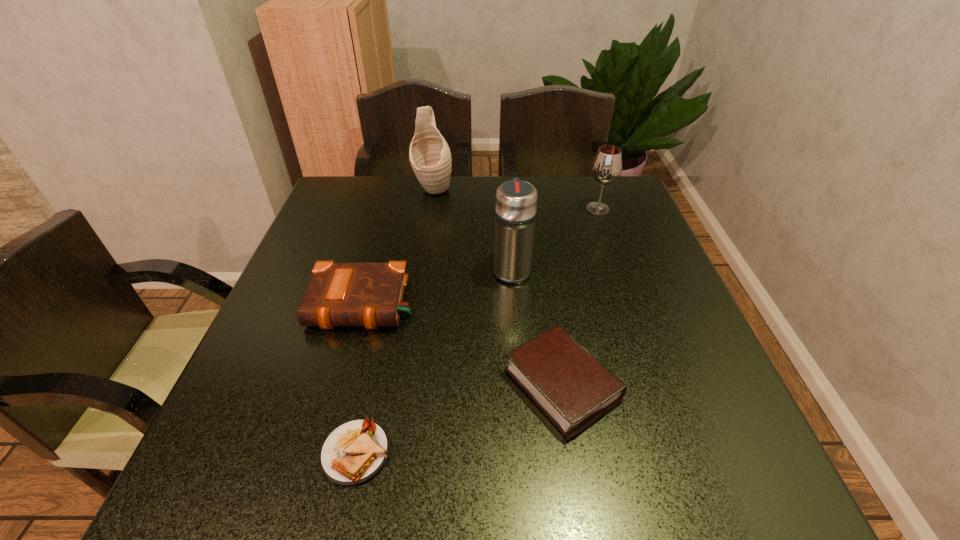
At what (x,y) coordinates should I click in order to perform the action: click on object present at the left edge. Please return your answer as a coordinate pair (x, y). Looking at the image, I should click on (339, 294).

The width and height of the screenshot is (960, 540). What are the coordinates of `object that is at the right edge` in the screenshot? It's located at (606, 167).

At what (x,y) coordinates should I click in order to perform the action: click on object that is positioned at the far right corner. Please return your answer as a coordinate pair (x, y). Looking at the image, I should click on (606, 167).

Where is `vacant area at the far edge`? The width and height of the screenshot is (960, 540). vacant area at the far edge is located at coordinates (550, 186).

You are a GUI agent. You are given a task and a screenshot of the screen. Output one action in this format:
    pyautogui.click(x=<x>, y=<y>)
    Task: Click on the vacant space at the near edge of the desktop
    The height and width of the screenshot is (540, 960).
    Given the screenshot: What is the action you would take?
    pyautogui.click(x=297, y=500)

At what (x,y) coordinates should I click in order to perform the action: click on vacant space at the left edge of the desktop. Please return your answer as a coordinate pair (x, y). The height and width of the screenshot is (540, 960). Looking at the image, I should click on (279, 329).

In the image, there is a desktop. At what (x,y) coordinates should I click in order to perform the action: click on vacant space at the right edge. Please return your answer as a coordinate pair (x, y). Looking at the image, I should click on (699, 353).

Locate an element on the screen. The image size is (960, 540). empty location between the shortest object and the thermos bottle is located at coordinates (434, 361).

You are a GUI agent. You are given a task and a screenshot of the screen. Output one action in this format:
    pyautogui.click(x=<x>, y=<y>)
    Task: Click on the blank region between the farther Bible and the thermos bottle
    The width and height of the screenshot is (960, 540).
    Given the screenshot: What is the action you would take?
    pyautogui.click(x=438, y=287)

You are a GUI agent. You are given a task and a screenshot of the screen. Output one action in this format:
    pyautogui.click(x=<x>, y=<y>)
    Task: Click on the empty space between the shorter Bible and the sandwich
    This screenshot has width=960, height=540.
    Given the screenshot: What is the action you would take?
    pyautogui.click(x=459, y=418)